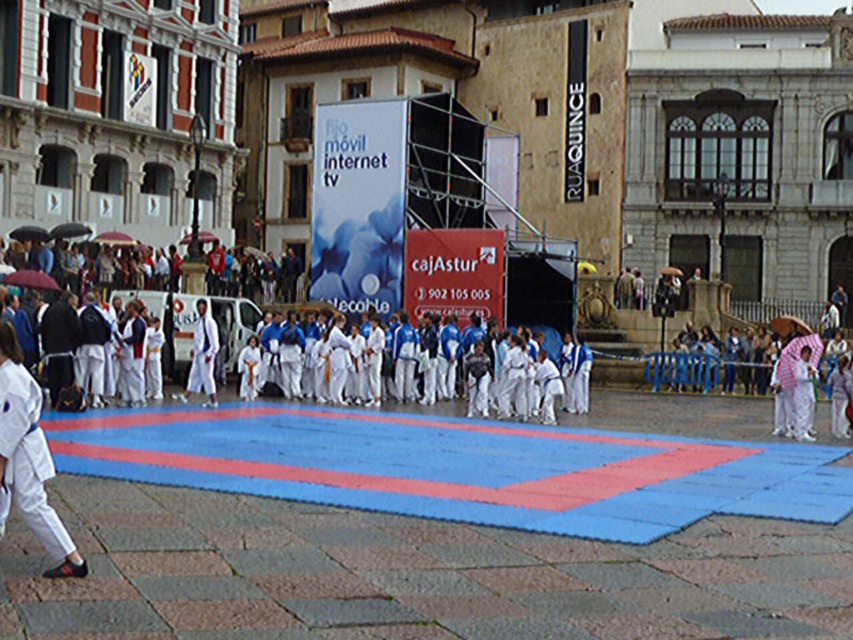
You are organizing a martial arts event and need to ensure participants have enough space between them for safety. The recommended distance is 70 feet. Given the positions of the white cotton karate gi at lower left and the white cotton karate uniform at center, do they meet the safety distance requirement?

The distance between the white cotton karate gi at lower left and the white cotton karate uniform at center is 69.27 feet, which is slightly less than the recommended 70 feet. Therefore, they do not meet the safety distance requirement.

You are a photographer positioned at the center of the square. You want to capture a photo that includes both the white cotton clothing at upper center and the white cotton karate gi at lower left. Which object should you pan your camera towards first to ensure both are in frame?

The white cotton clothing at upper center is to the left of the white cotton karate gi at lower left. To include both in the frame, you should pan your camera towards the white cotton clothing at upper center first, as it is positioned to the left side of the karate gi.